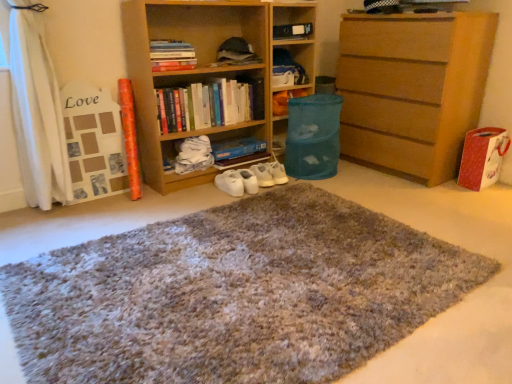
Question: Is shaggy carpet at center in front of or behind light brown wooden chest of drawers at right in the image?

Choices:
 (A) behind
 (B) front

Answer: (B)

Question: Is shaggy carpet at center to the left or to the right of light brown wooden chest of drawers at right in the image?

Choices:
 (A) left
 (B) right

Answer: (A)

Question: Which of these objects is positioned closest to the wooden bookshelf at center?

Choices:
 (A) white matte sneakers at center
 (B) light brown wooden chest of drawers at right
 (C) hardcover book at upper center, the second book when ordered from bottom to top
 (D) blue fabric bean bag chair at center
 (E) translucent plastic bin at center

Answer: (C)

Question: Which object is the closest to the hardcover book at upper center, the second book when ordered from bottom to top?

Choices:
 (A) blue fabric bean bag chair at center
 (B) white matte sneakers at center
 (C) translucent plastic bin at center
 (D) shaggy carpet at center
 (E) hardcover books at center, which is the second book from top to bottom

Answer: (E)